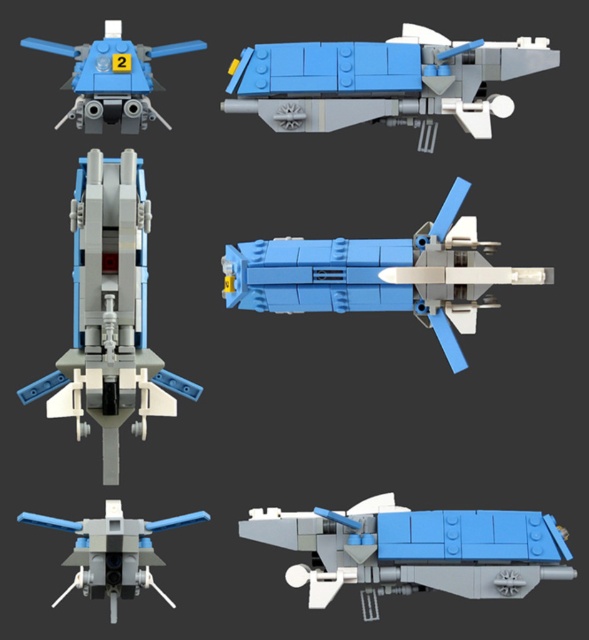
From the picture: Is matte blue plastic spaceship at upper left positioned in front of matte blue plastic spaceship at bottom left?

That is False.

Between matte blue plastic spaceship at upper left and matte blue plastic spaceship at bottom left, which one is positioned lower?

matte blue plastic spaceship at bottom left is lower down.

Measure the distance between point (80, 72) and camera.

Point (80, 72) is 4.72 meters away from camera.

Find the location of a particular element. The height and width of the screenshot is (640, 589). matte blue plastic spaceship at upper left is located at coordinates (111, 77).

Is point (431, 49) positioned behind point (140, 60)?

Yes, it is behind point (140, 60).

Which is behind, point (451, 52) or point (108, 76)?

The point (108, 76) is behind.

Find the location of a particular element. blue plastic spaceship at upper center is located at coordinates (382, 81).

Is point (327, 284) less distant than point (124, 580)?

No, (327, 284) is behind (124, 580).

Image resolution: width=589 pixels, height=640 pixels. Find the location of `matte blue spaceship at center`. matte blue spaceship at center is located at coordinates (379, 275).

This screenshot has height=640, width=589. I want to click on matte blue spaceship at center, so click(x=379, y=275).